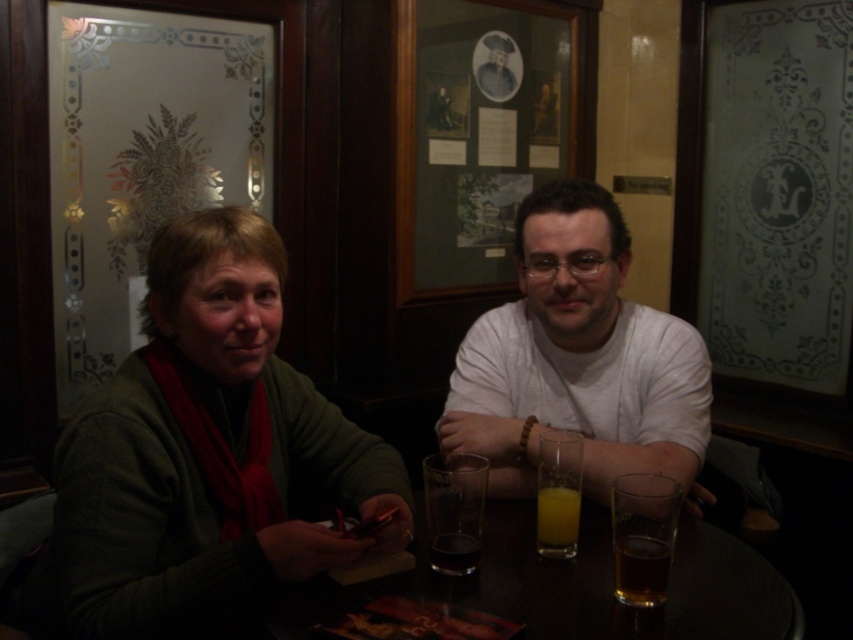
Is white matte shirt at center closer to camera compared to clear glass at table center?

No.

Based on the photo, is white matte shirt at center thinner than clear glass at table center?

No, white matte shirt at center is not thinner than clear glass at table center.

This screenshot has width=853, height=640. In order to click on white matte shirt at center in this screenshot , I will do `click(578, 358)`.

In the scene shown: Can you confirm if green sweater at left is bigger than translucent glass table at center?

Yes.

Who is more distant from viewer, (225, 388) or (521, 618)?

Positioned behind is point (225, 388).

Where is `green sweater at left`? The image size is (853, 640). green sweater at left is located at coordinates (206, 449).

Consider the image. Does brown translucent glass at lower right appear on the left side of translucent glass at table center?

No, brown translucent glass at lower right is not to the left of translucent glass at table center.

Between brown translucent glass at lower right and translucent glass at table center, which one is positioned higher?

translucent glass at table center is higher up.

Does point (630, 554) come closer to viewer compared to point (550, 531)?

Yes, point (630, 554) is closer to viewer.

This screenshot has width=853, height=640. I want to click on brown translucent glass at lower right, so click(x=640, y=570).